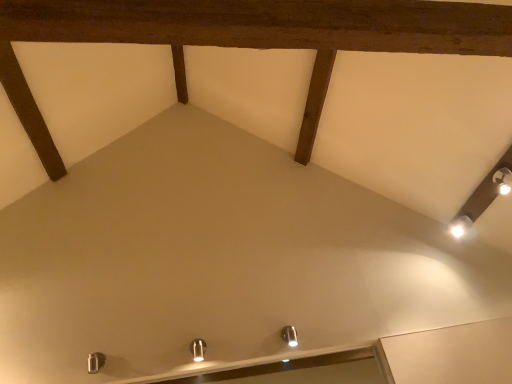
Question: Is metallic silver light fixture at center, marked as the third light fixture in a back-to-front arrangement, facing away from satin nickel light fixture at lower center, arranged as the 2th light fixture when viewed from the back?

Choices:
 (A) no
 (B) yes

Answer: (A)

Question: Does metallic silver light fixture at center, placed as the first light fixture when sorted from front to back, have a smaller size compared to satin nickel light fixture at lower center, arranged as the 2th light fixture when viewed from the back?

Choices:
 (A) no
 (B) yes

Answer: (A)

Question: Can you confirm if metallic silver light fixture at center, marked as the third light fixture in a back-to-front arrangement, is taller than satin nickel light fixture at lower center, which is the second light fixture from bottom to top?

Choices:
 (A) yes
 (B) no

Answer: (A)

Question: From the image's perspective, is metallic silver light fixture at center, which is the 3th light fixture from right to left, below satin nickel light fixture at lower center, which ranks as the second light fixture in right-to-left order?

Choices:
 (A) no
 (B) yes

Answer: (B)

Question: Considering the relative sizes of metallic silver light fixture at center, marked as the third light fixture in a back-to-front arrangement, and satin nickel light fixture at lower center, which is the second light fixture from bottom to top, in the image provided, is metallic silver light fixture at center, marked as the third light fixture in a back-to-front arrangement, shorter than satin nickel light fixture at lower center, which is the second light fixture from bottom to top,?

Choices:
 (A) no
 (B) yes

Answer: (A)

Question: Based on their positions, is satin nickel light fixture at lower center, which ranks as the second light fixture in right-to-left order, located to the left or right of white glossy light fixture at upper right, the third light fixture in the left-to-right sequence?

Choices:
 (A) left
 (B) right

Answer: (A)

Question: From the image's perspective, is satin nickel light fixture at lower center, acting as the 2th light fixture starting from the left, positioned above or below white glossy light fixture at upper right, the 3th light fixture in the bottom-to-top sequence?

Choices:
 (A) above
 (B) below

Answer: (B)

Question: Looking at the image, does satin nickel light fixture at lower center, acting as the 2th light fixture starting from the left, seem bigger or smaller compared to white glossy light fixture at upper right, which is the first light fixture from right to left?

Choices:
 (A) big
 (B) small

Answer: (B)

Question: Looking at their shapes, would you say satin nickel light fixture at lower center, which ranks as the second light fixture in right-to-left order, is wider or thinner than white glossy light fixture at upper right, the third light fixture in the left-to-right sequence?

Choices:
 (A) thin
 (B) wide

Answer: (A)

Question: Considering the positions of white glossy light fixture at upper right, the third light fixture in the left-to-right sequence, and satin nickel light fixture at lower center, acting as the 2th light fixture starting from the left, in the image, is white glossy light fixture at upper right, the third light fixture in the left-to-right sequence, taller or shorter than satin nickel light fixture at lower center, acting as the 2th light fixture starting from the left,?

Choices:
 (A) tall
 (B) short

Answer: (B)

Question: In the image, is white glossy light fixture at upper right, the 3th light fixture in the bottom-to-top sequence, positioned in front of or behind satin nickel light fixture at lower center, acting as the 2th light fixture starting from the left?

Choices:
 (A) front
 (B) behind

Answer: (B)

Question: Looking at their shapes, would you say white glossy light fixture at upper right, marked as the 1th light fixture in a top-to-bottom arrangement, is wider or thinner than satin nickel light fixture at lower center, the 2th light fixture from the top?

Choices:
 (A) wide
 (B) thin

Answer: (A)

Question: Would you say white glossy light fixture at upper right, the third light fixture in the left-to-right sequence, is inside or outside satin nickel light fixture at lower center, which is the second light fixture from bottom to top?

Choices:
 (A) outside
 (B) inside

Answer: (A)

Question: In terms of height, does metallic silver light fixture at center, which is the 3th light fixture from right to left, look taller or shorter compared to satin nickel light fixture at lower center, the 2th light fixture from the top?

Choices:
 (A) short
 (B) tall

Answer: (B)

Question: Is metallic silver light fixture at center, placed as the first light fixture when sorted from front to back, inside or outside of satin nickel light fixture at lower center, the second light fixture when ordered from front to back?

Choices:
 (A) inside
 (B) outside

Answer: (B)